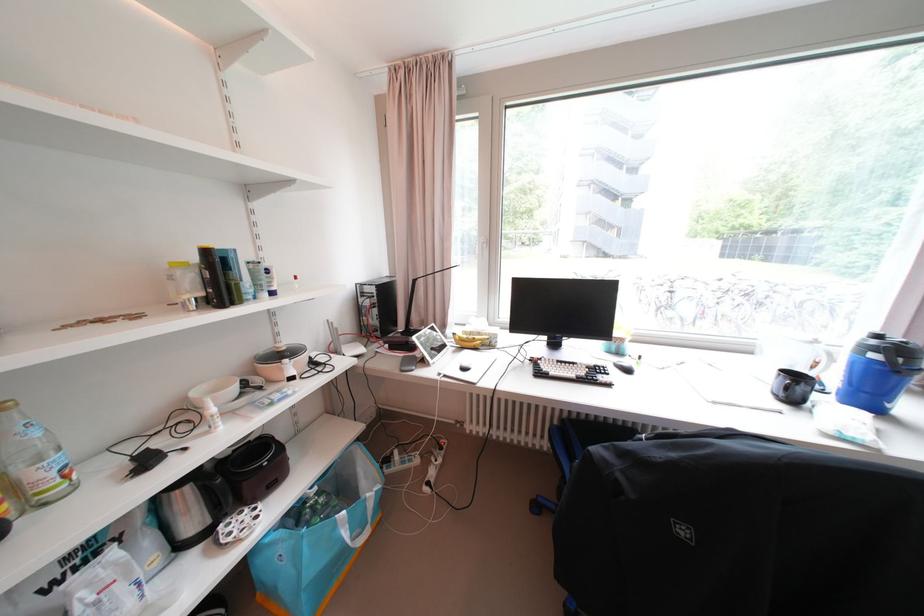
Where would you open the black monitor? Please return your answer as a coordinate pair (x, y).

(563, 307)